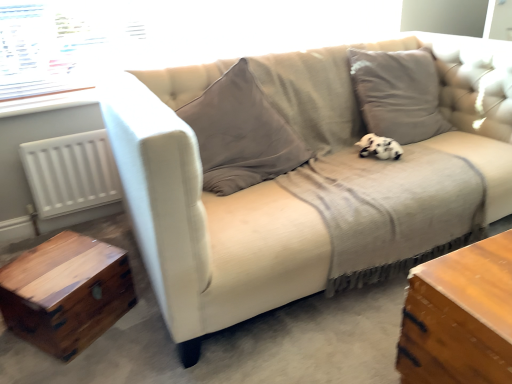
Question: Can you confirm if beige fabric couch at center is wider than white matte radiator at left?

Choices:
 (A) no
 (B) yes

Answer: (B)

Question: Is beige fabric couch at center positioned far away from white matte radiator at left?

Choices:
 (A) no
 (B) yes

Answer: (A)

Question: Can you confirm if beige fabric couch at center is positioned to the left of white matte radiator at left?

Choices:
 (A) yes
 (B) no

Answer: (B)

Question: Is white matte radiator at left completely or partially inside beige fabric couch at center?

Choices:
 (A) yes
 (B) no

Answer: (B)

Question: Does beige fabric couch at center have a lesser width compared to white matte radiator at left?

Choices:
 (A) no
 (B) yes

Answer: (A)

Question: Considering the positions of white matte radiator at left and wooden trunk at lower left in the image, is white matte radiator at left taller or shorter than wooden trunk at lower left?

Choices:
 (A) short
 (B) tall

Answer: (B)

Question: Does point (61, 155) appear closer or farther from the camera than point (4, 276)?

Choices:
 (A) closer
 (B) farther

Answer: (B)

Question: Is white matte radiator at left to the left or to the right of wooden trunk at lower left in the image?

Choices:
 (A) right
 (B) left

Answer: (B)

Question: Is white matte radiator at left bigger or smaller than wooden trunk at lower left?

Choices:
 (A) big
 (B) small

Answer: (B)

Question: In terms of height, does transparent glass window at upper left look taller or shorter compared to beige fabric couch at center?

Choices:
 (A) tall
 (B) short

Answer: (B)

Question: Is point (395, 6) positioned closer to the camera than point (146, 266)?

Choices:
 (A) farther
 (B) closer

Answer: (A)

Question: Do you think transparent glass window at upper left is within beige fabric couch at center, or outside of it?

Choices:
 (A) inside
 (B) outside

Answer: (B)

Question: Is transparent glass window at upper left to the left or to the right of beige fabric couch at center in the image?

Choices:
 (A) right
 (B) left

Answer: (B)

Question: Is transparent glass window at upper left wider or thinner than white matte radiator at left?

Choices:
 (A) thin
 (B) wide

Answer: (A)

Question: From the image's perspective, is transparent glass window at upper left positioned above or below white matte radiator at left?

Choices:
 (A) above
 (B) below

Answer: (A)